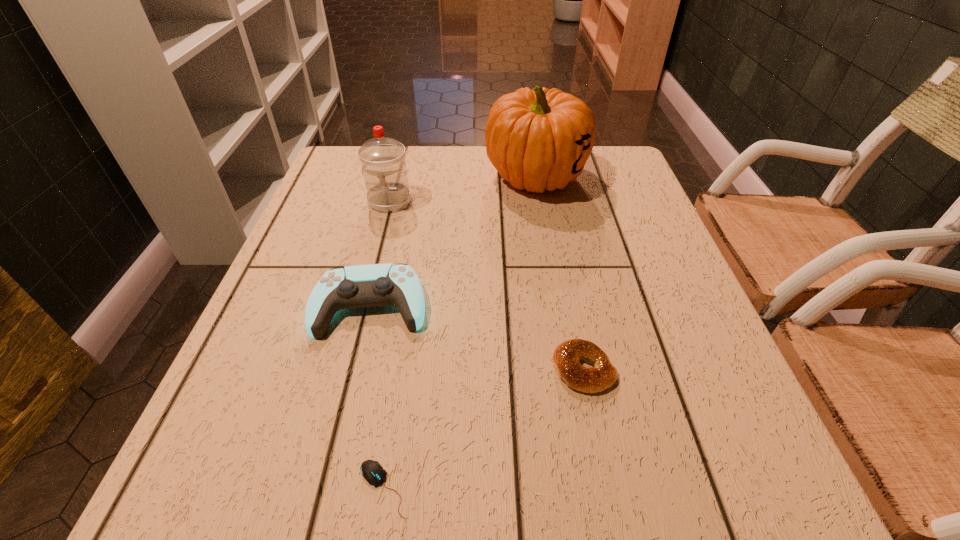
Where is `object present at the far right corner`? This screenshot has height=540, width=960. object present at the far right corner is located at coordinates (538, 139).

Find the location of a particular element. The height and width of the screenshot is (540, 960). blank space at the far edge of the desktop is located at coordinates (417, 177).

In the image, there is a desktop. Where is `vacant space at the near edge`? vacant space at the near edge is located at coordinates (x=329, y=484).

In the image, there is a desktop. Where is `blank space at the left edge`? blank space at the left edge is located at coordinates (347, 253).

The width and height of the screenshot is (960, 540). I want to click on vacant space at the right edge of the desktop, so click(x=767, y=443).

This screenshot has height=540, width=960. Identify the location of vacant area at the far left corner of the desktop. (346, 185).

You are a GUI agent. You are given a task and a screenshot of the screen. Output one action in this format:
    pyautogui.click(x=<x>, y=<y>)
    Task: Click on the free space at the near left corner
    The image size is (960, 540).
    Given the screenshot: What is the action you would take?
    pyautogui.click(x=277, y=452)

Where is `vacant space at the far right corner of the desktop`? Image resolution: width=960 pixels, height=540 pixels. vacant space at the far right corner of the desktop is located at coordinates (580, 189).

You are a GUI agent. You are given a task and a screenshot of the screen. Output one action in this format:
    pyautogui.click(x=<x>, y=<y>)
    Task: Click on the vacant area that lies between the third shortest object and the water bottle
    The image size is (960, 540).
    Given the screenshot: What is the action you would take?
    pyautogui.click(x=380, y=253)

Find the location of `free point between the fourth shortest object and the tallest object`. free point between the fourth shortest object and the tallest object is located at coordinates (463, 188).